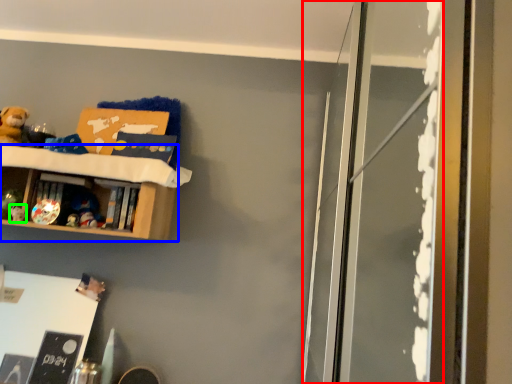
Question: Which object is the closest to the screen door (highlighted by a red box)? Choose among these: shelf (highlighted by a blue box) or toy (highlighted by a green box).

Choices:
 (A) shelf
 (B) toy

Answer: (A)